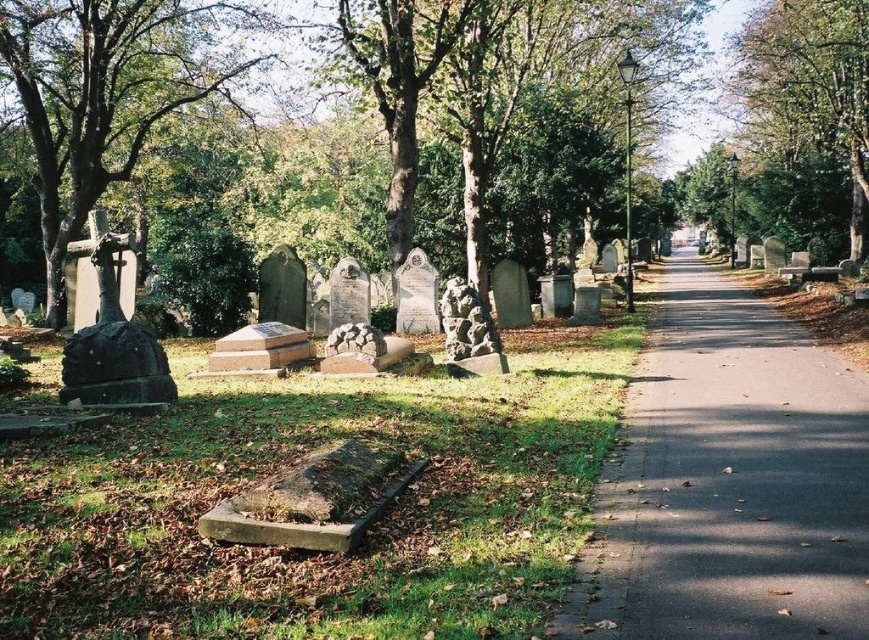
Does green leafy tree at left have a greater width compared to green leafy tree at upper center?

Correct, the width of green leafy tree at left exceeds that of green leafy tree at upper center.

Does green leafy tree at left appear on the right side of green leafy tree at upper center?

Incorrect, green leafy tree at left is not on the right side of green leafy tree at upper center.

Where is `green leafy tree at left`? Image resolution: width=869 pixels, height=640 pixels. green leafy tree at left is located at coordinates (110, 90).